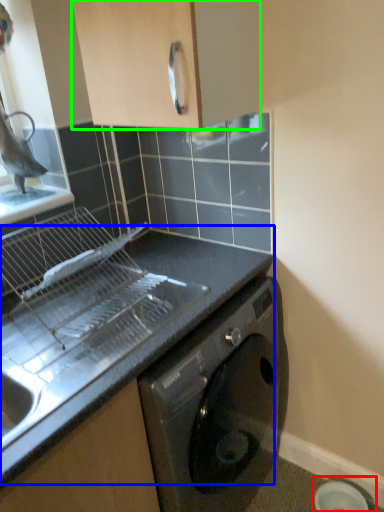
Question: Which object is positioned closest to appliance (highlighted by a red box)? Select from countertop (highlighted by a blue box) and cabinetry (highlighted by a green box).

Choices:
 (A) countertop
 (B) cabinetry

Answer: (A)